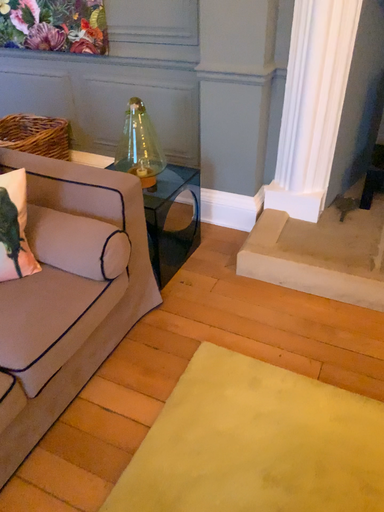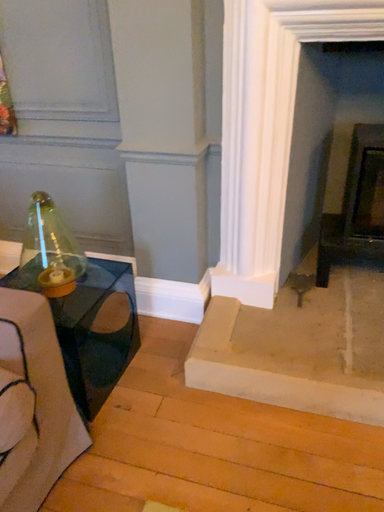
Question: Which way did the camera rotate in the video?

Choices:
 (A) rotated upward
 (B) rotated downward

Answer: (A)